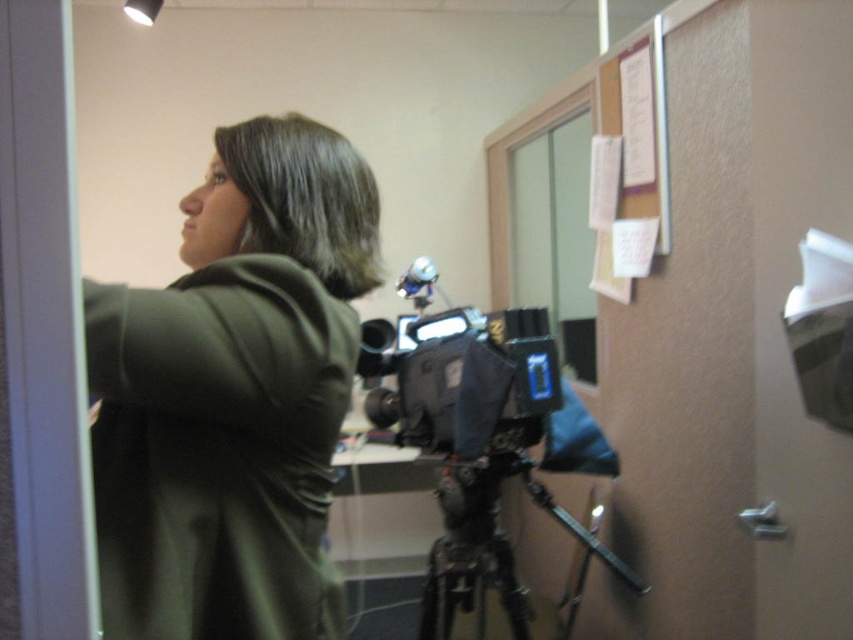
You are a photographer adjusting the camera in the scene. You notice the green matte jacket at upper left and the black fabric camera at center. Which object is closer to the camera lens?

The green matte jacket at upper left is closer to the camera lens because it is in front of the black fabric camera at center.

You are a camera operator who needs to adjust the focus of the black matte video camera at center. You are currently standing 6 feet away from the camera. Can you reach the focus ring without moving closer?

The black matte video camera at center and viewer are 5.93 feet apart from each other. Since you are standing 6 feet away, you are slightly farther than the distance between the camera and viewer. Therefore, you may not be able to reach the focus ring without moving closer.

You are a videographer setting up equipment in an office. You have two cameras, the black matte video camera at center and the black fabric camera at center. Which camera is closer to you?

The black matte video camera at center is closer to you than the black fabric camera at center.